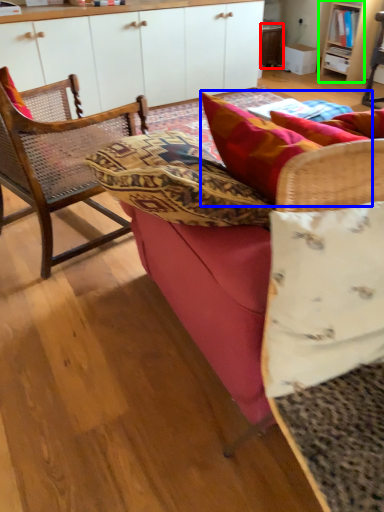
Question: Estimate the real-world distances between objects in this image. Which object is farther from table (highlighted by a red box), pillow (highlighted by a blue box) or shelf (highlighted by a green box)?

Choices:
 (A) pillow
 (B) shelf

Answer: (A)